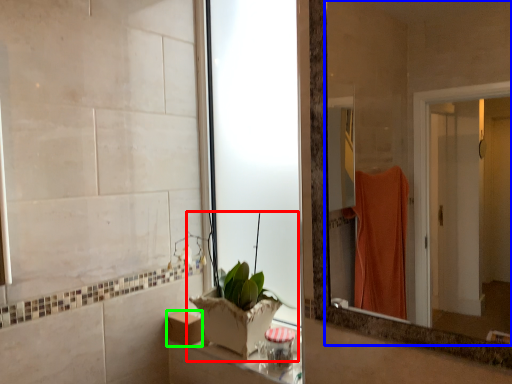
Question: Considering the real-world distances, which object is closest to houseplant (highlighted by a red box)? mirror (highlighted by a blue box) or box (highlighted by a green box).

Choices:
 (A) mirror
 (B) box

Answer: (B)